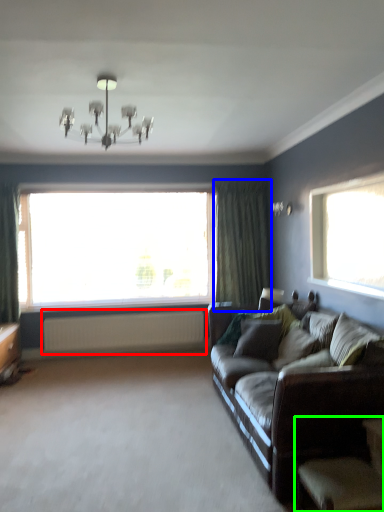
Question: Estimate the real-world distances between objects in this image. Which object is farther from radiator (highlighted by a red box), curtain (highlighted by a blue box) or armchair (highlighted by a green box)?

Choices:
 (A) curtain
 (B) armchair

Answer: (B)